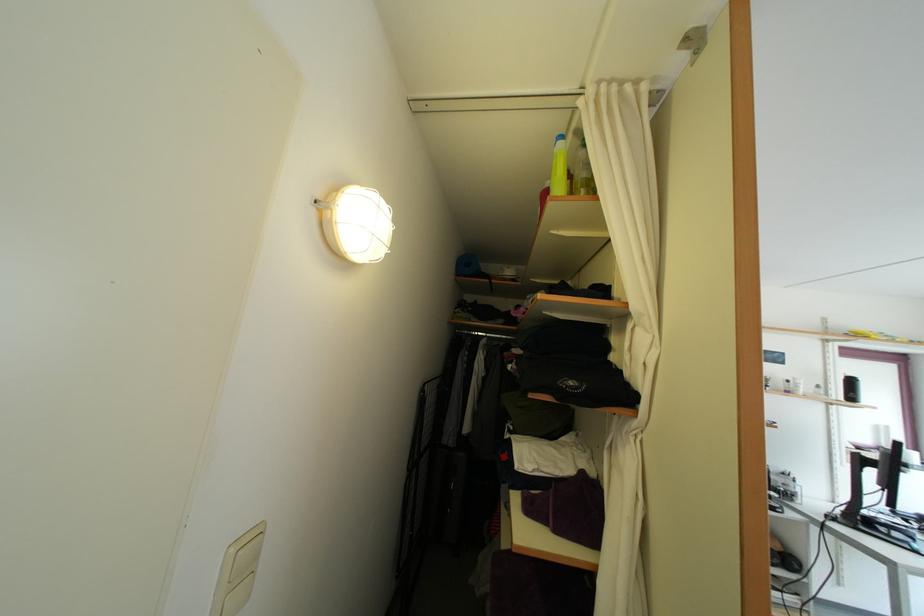
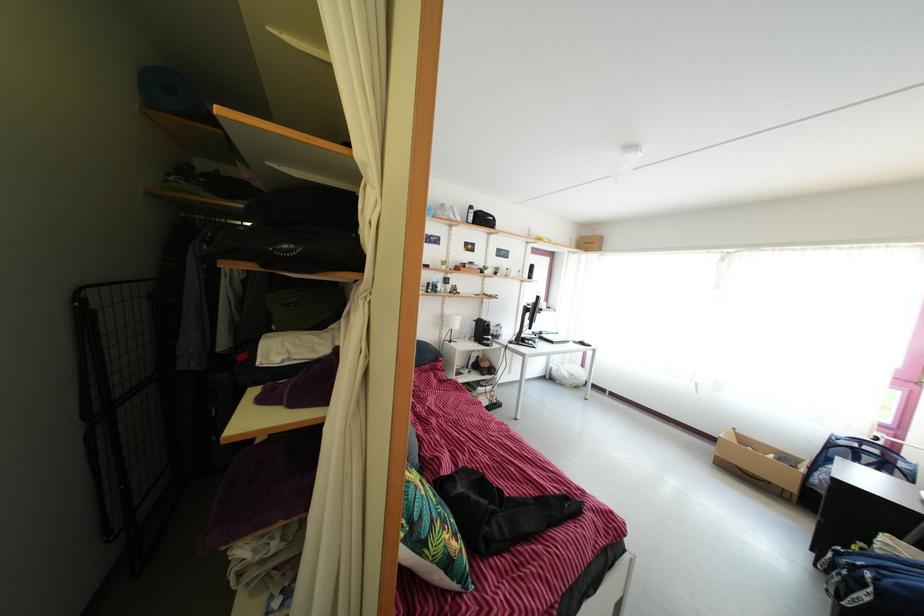
The point at (429, 399) is marked in the first image. Where is the corresponding point in the second image?

(86, 307)